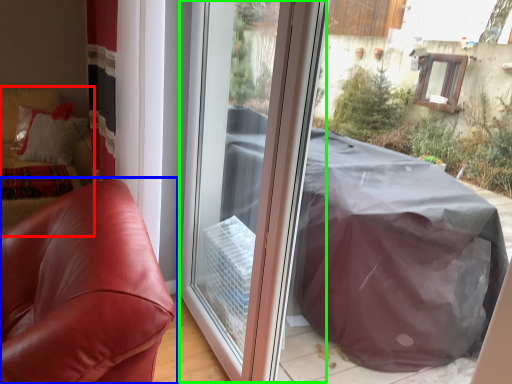
Question: Estimate the real-world distances between objects in this image. Which object is farther from couch (highlighted by a red box), furniture (highlighted by a blue box) or screen door (highlighted by a green box)?

Choices:
 (A) furniture
 (B) screen door

Answer: (A)